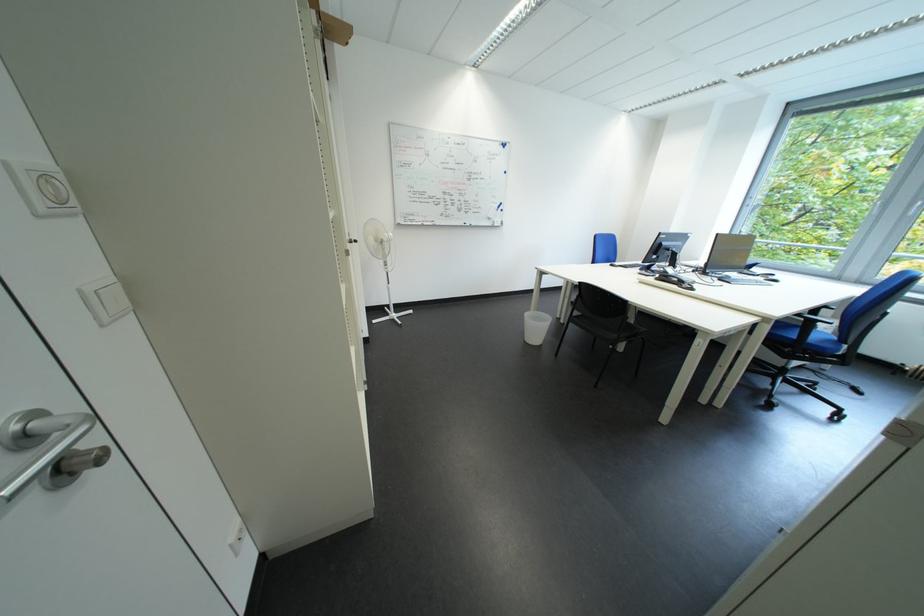
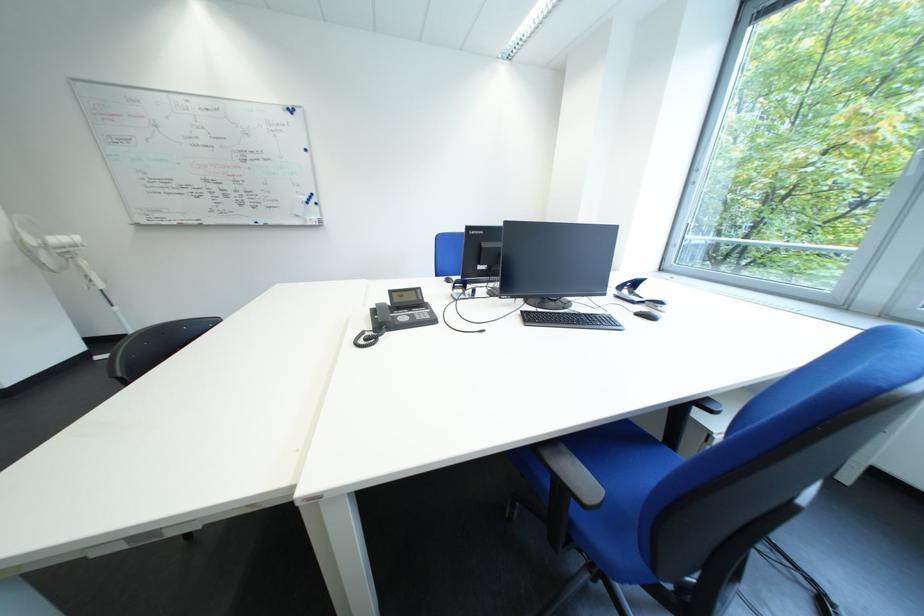
In a continuous first-person perspective shot, in which direction is the camera moving?

The movement direction of the cameraman is right, forward.